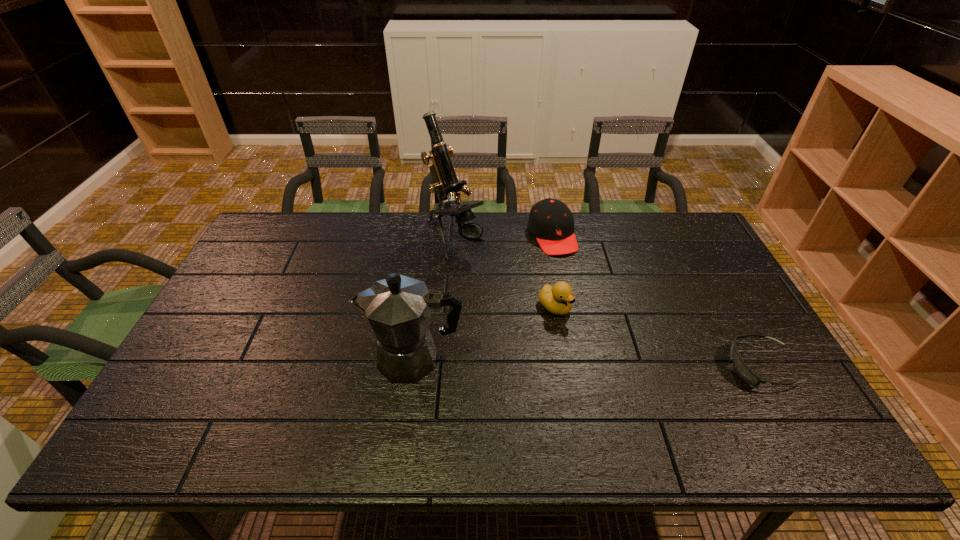
This screenshot has width=960, height=540. I want to click on coffeepot, so click(x=398, y=308).

Identify the location of the rightmost object. (741, 368).

Where is `goggles`? This screenshot has width=960, height=540. goggles is located at coordinates (741, 368).

What are the coordinates of `microscope` in the screenshot? It's located at (446, 182).

The height and width of the screenshot is (540, 960). I want to click on duckling, so click(558, 299).

Locate an element on the screen. The image size is (960, 540). cap is located at coordinates (551, 221).

Locate an element on the screen. Image resolution: width=960 pixels, height=540 pixels. vacant area situated 0.280m on the pouring side of the fourth shortest object is located at coordinates point(258,359).

Find the location of a particular element. vacant space positioned 0.180m on the pouring side of the fourth shortest object is located at coordinates (296, 359).

The image size is (960, 540). I want to click on free spot located 0.110m on the pouring side of the fourth shortest object, so click(x=323, y=359).

Locate an element on the screen. free point located 0.180m on the lenses of the rightmost object is located at coordinates (659, 367).